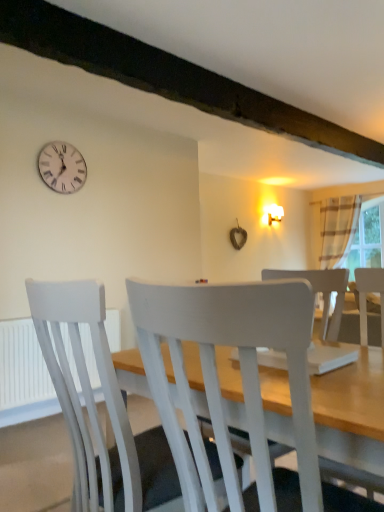
How much space does white painted wood chair at center, the 1th chair in the front-to-back sequence, occupy horizontally?

22.44 inches.

Where is `striped fabric curtain at right`? The image size is (384, 512). striped fabric curtain at right is located at coordinates (337, 229).

At what (x,y) coordinates should I click in order to perform the action: click on white painted wood chair at center, placed as the second chair when sorted from front to back. Please return your answer as a coordinate pair (x, y). The image size is (384, 512). Looking at the image, I should click on (96, 411).

In order to face white plastic clock at upper left, should I rotate leftwards or rightwards?

Rotate your view left by about 16.587°.

Measure the distance between clear glass window at right and camera.

clear glass window at right is 5.84 meters away from camera.

The image size is (384, 512). Describe the element at coordinates (365, 239) in the screenshot. I see `clear glass window at right` at that location.

Identify the location of white plastic radiator at lower left. This screenshot has height=512, width=384. (24, 371).

Is white painted wood chair at center, placed as the second chair when sorted from front to back, looking in the opposite direction of white plastic radiator at lower left?

No, white painted wood chair at center, placed as the second chair when sorted from front to back,'s orientation is not away from white plastic radiator at lower left.

Considering the sizes of white painted wood chair at center, placed as the second chair when sorted from front to back, and white plastic radiator at lower left in the image, is white painted wood chair at center, placed as the second chair when sorted from front to back, taller or shorter than white plastic radiator at lower left?

Clearly, white painted wood chair at center, placed as the second chair when sorted from front to back, is taller compared to white plastic radiator at lower left.

I want to click on radiator on the left of white painted wood chair at center, the first chair from the back, so click(x=24, y=371).

What's the angular difference between white painted wood chair at center, the first chair from the back, and white plastic radiator at lower left's facing directions?

The facing directions of white painted wood chair at center, the first chair from the back, and white plastic radiator at lower left are 90.6 degrees apart.

Does point (56, 156) lie in front of point (330, 253)?

Yes.

Does white plastic clock at upper left have a greater width compared to striped fabric curtain at right?

Incorrect, the width of white plastic clock at upper left does not surpass that of striped fabric curtain at right.

Would you say striped fabric curtain at right is part of white plastic clock at upper left's contents?

Definitely not — striped fabric curtain at right is not inside white plastic clock at upper left.

From a real-world perspective, is white plastic clock at upper left physically located above or below striped fabric curtain at right?

Clearly, from a real-world perspective, white plastic clock at upper left is above striped fabric curtain at right.

Considering the relative sizes of striped fabric curtain at right and white plastic radiator at lower left in the image provided, is striped fabric curtain at right bigger than white plastic radiator at lower left?

Indeed, striped fabric curtain at right has a larger size compared to white plastic radiator at lower left.

Considering the points (343, 222) and (113, 349), which point is in front, point (343, 222) or point (113, 349)?

Positioned in front is point (113, 349).

Are striped fabric curtain at right and white plastic radiator at lower left located far from each other?

Indeed, striped fabric curtain at right is not near white plastic radiator at lower left.

Considering the sizes of objects striped fabric curtain at right and white plastic radiator at lower left in the image provided, who is thinner, striped fabric curtain at right or white plastic radiator at lower left?

white plastic radiator at lower left.

Does clear glass window at right have a lesser height compared to white painted wood chair at center, the first chair from the back?

In fact, clear glass window at right may be taller than white painted wood chair at center, the first chair from the back.

From a real-world perspective, which object rests below the other?

In real-world perspective, white painted wood chair at center, placed as the second chair when sorted from front to back, is lower.

Are clear glass window at right and white painted wood chair at center, the first chair from the back, far apart?

Yes, clear glass window at right is far from white painted wood chair at center, the first chair from the back.

How many degrees apart are the facing directions of clear glass window at right and white painted wood chair at center, placed as the second chair when sorted from front to back?

The facing directions of clear glass window at right and white painted wood chair at center, placed as the second chair when sorted from front to back, are 179 degrees apart.

Which object is closer to the camera, clear glass window at right or white plastic radiator at lower left?

white plastic radiator at lower left is in front.

From the image's perspective, is clear glass window at right beneath white plastic radiator at lower left?

No, from the image's perspective, clear glass window at right is not beneath white plastic radiator at lower left.

From a real-world perspective, is clear glass window at right above or below white plastic radiator at lower left?

Clearly, from a real-world perspective, clear glass window at right is above white plastic radiator at lower left.

Measure the distance between white painted wood chair at center, the 1th chair in the front-to-back sequence, and white painted wood chair at center, placed as the second chair when sorted from front to back.

The distance of white painted wood chair at center, the 1th chair in the front-to-back sequence, from white painted wood chair at center, placed as the second chair when sorted from front to back, is 24.45 centimeters.

Locate an element on the screen. chair below the white painted wood chair at center, the 1th chair in the front-to-back sequence (from a real-world perspective) is located at coordinates (96, 411).

Are white painted wood chair at center, which appears as the second chair when viewed from the back, and white painted wood chair at center, the first chair from the back, far apart?

No, white painted wood chair at center, which appears as the second chair when viewed from the back, is not far from white painted wood chair at center, the first chair from the back.

What's the angular difference between white painted wood chair at center, which appears as the second chair when viewed from the back, and white painted wood chair at center, placed as the second chair when sorted from front to back,'s facing directions?

The facing directions of white painted wood chair at center, which appears as the second chair when viewed from the back, and white painted wood chair at center, placed as the second chair when sorted from front to back, are 0.000619 degrees apart.

Between white plastic clock at upper left and white plastic radiator at lower left, which one appears on the right side from the viewer's perspective?

Positioned to the right is white plastic radiator at lower left.

From the image's perspective, which one is positioned lower, white plastic clock at upper left or white plastic radiator at lower left?

white plastic radiator at lower left.

In the scene shown: Is the position of white plastic clock at upper left less distant than that of white plastic radiator at lower left?

That is False.

Find the location of a particular element. This screenshot has height=512, width=384. radiator located behind the white painted wood chair at center, the first chair from the back is located at coordinates (24, 371).

In the image, there is a white plastic clock at upper left. Find the location of `curtain below it (from a real-world perspective)`. curtain below it (from a real-world perspective) is located at coordinates pos(337,229).

When comparing their distances from white painted wood chair at center, placed as the second chair when sorted from front to back, does white plastic clock at upper left or white plastic radiator at lower left seem closer?

white plastic radiator at lower left is positioned closer to the anchor white painted wood chair at center, placed as the second chair when sorted from front to back.

When comparing their distances from white painted wood chair at center, which appears as the second chair when viewed from the back, does clear glass window at right or white painted wood chair at center, placed as the second chair when sorted from front to back, seem closer?

Based on the image, white painted wood chair at center, placed as the second chair when sorted from front to back, appears to be nearer to white painted wood chair at center, which appears as the second chair when viewed from the back.

Looking at the image, which one is located further to striped fabric curtain at right, white plastic radiator at lower left or white plastic clock at upper left?

white plastic radiator at lower left is positioned further to the anchor striped fabric curtain at right.

Estimate the real-world distances between objects in this image. Which object is closer to white painted wood chair at center, the first chair from the back, white plastic clock at upper left or clear glass window at right?

white plastic clock at upper left lies closer to white painted wood chair at center, the first chair from the back, than the other object.

Based on their spatial positions, is clear glass window at right or white painted wood chair at center, placed as the second chair when sorted from front to back, closer to white plastic clock at upper left?

white painted wood chair at center, placed as the second chair when sorted from front to back, is positioned closer to the anchor white plastic clock at upper left.

Considering their positions, is white painted wood chair at center, the 1th chair in the front-to-back sequence, positioned closer to white plastic clock at upper left than white painted wood chair at center, the first chair from the back?

white painted wood chair at center, the first chair from the back, is closer to white plastic clock at upper left.

Based on their spatial positions, is clear glass window at right or white painted wood chair at center, the 1th chair in the front-to-back sequence, closer to white painted wood chair at center, placed as the second chair when sorted from front to back?

Among the two, white painted wood chair at center, the 1th chair in the front-to-back sequence, is located nearer to white painted wood chair at center, placed as the second chair when sorted from front to back.

Based on the photo, when comparing their distances from white painted wood chair at center, the first chair from the back, does striped fabric curtain at right or white painted wood chair at center, the 1th chair in the front-to-back sequence, seem further?

Among the two, striped fabric curtain at right is located further to white painted wood chair at center, the first chair from the back.

Identify the location of wall clock between white painted wood chair at center, placed as the second chair when sorted from front to back, and clear glass window at right from front to back. The image size is (384, 512). (62, 167).

At what (x,y) coordinates should I click in order to perform the action: click on curtain positioned between white painted wood chair at center, the 1th chair in the front-to-back sequence, and clear glass window at right from near to far. Please return your answer as a coordinate pair (x, y). This screenshot has width=384, height=512. Looking at the image, I should click on (337, 229).

Identify the location of radiator positioned between white painted wood chair at center, placed as the second chair when sorted from front to back, and striped fabric curtain at right from near to far. The width and height of the screenshot is (384, 512). (24, 371).

Where is `chair between white painted wood chair at center, the 1th chair in the front-to-back sequence, and white plastic clock at upper left in the front-back direction`? Image resolution: width=384 pixels, height=512 pixels. chair between white painted wood chair at center, the 1th chair in the front-to-back sequence, and white plastic clock at upper left in the front-back direction is located at coordinates pos(96,411).